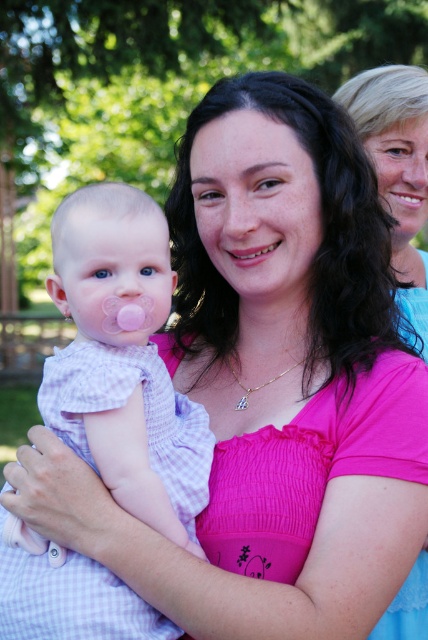
Which is behind, point (163, 528) or point (362, 141)?

Point (362, 141)

What are the coordinates of `pink checkered fabric at left` in the screenshot? It's located at pos(124,362).

Is point (94, 216) behind point (229, 250)?

No, (94, 216) is in front of (229, 250).

Does pink checkered fabric at left appear over smooth skin at center?

Incorrect, pink checkered fabric at left is not positioned above smooth skin at center.

Locate an element on the screen. pink checkered fabric at left is located at coordinates (124, 362).

Can you confirm if pink fabric shirt at center is smaller than smooth skin mouth at upper right?

No.

At what (x,y) coordinates should I click in order to perform the action: click on pink fabric shirt at center. Please return your answer as a coordinate pair (x, y). The image size is (428, 640). Looking at the image, I should click on (397, 172).